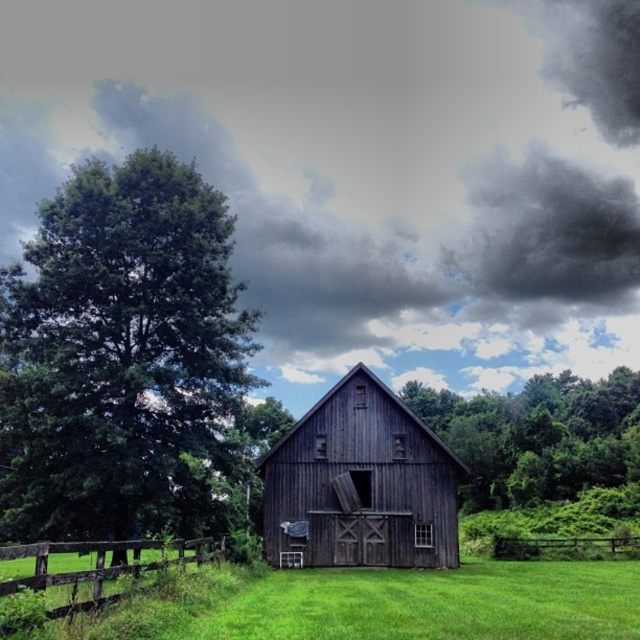
Based on the photo, is green leafy tree at center bigger than brown wooden fence at lower left?

Indeed, green leafy tree at center has a larger size compared to brown wooden fence at lower left.

Which is above, green leafy tree at center or brown wooden fence at lower left?

brown wooden fence at lower left

This screenshot has height=640, width=640. Identify the location of green leafy tree at center. (538, 435).

Who is taller, green leafy tree at left or green leafy tree at center?

green leafy tree at left

Who is more distant from viewer, (106,227) or (458,438)?

Positioned behind is point (458,438).

I want to click on green leafy tree at left, so click(120, 355).

From the picture: Who is more distant from viewer, (256, 10) or (116, 573)?

The point (256, 10) is behind.

Is dark gray cloud at upper center shorter than brown wooden fence at lower left?

Incorrect, dark gray cloud at upper center's height does not fall short of brown wooden fence at lower left's.

Between point (317, 125) and point (147, 545), which one is positioned behind?

Point (317, 125)

The image size is (640, 640). I want to click on dark gray cloud at upper center, so click(371, 170).